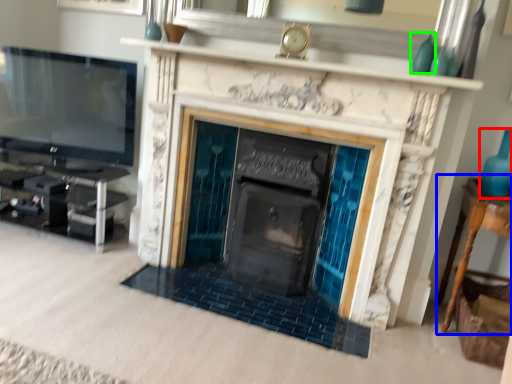
Question: Based on their relative distances, which object is nearer to glass vase (highlighted by a red box)? Choose from table (highlighted by a blue box) and turquoise (highlighted by a green box).

Choices:
 (A) table
 (B) turquoise

Answer: (A)